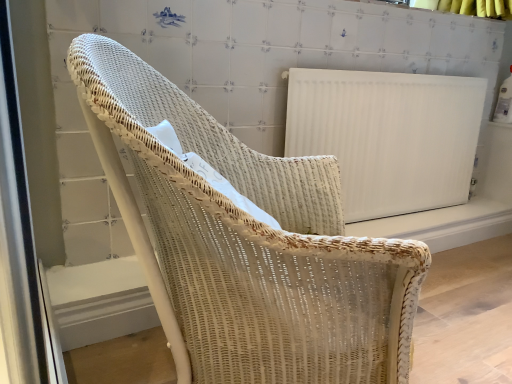
Question: Is the surface of white wicker chair at center in direct contact with white ribbed radiator at upper right?

Choices:
 (A) no
 (B) yes

Answer: (A)

Question: Is white wicker chair at center further to camera compared to white ribbed radiator at upper right?

Choices:
 (A) yes
 (B) no

Answer: (B)

Question: Can you confirm if white wicker chair at center is taller than white ribbed radiator at upper right?

Choices:
 (A) yes
 (B) no

Answer: (A)

Question: Considering the relative sizes of white wicker chair at center and white ribbed radiator at upper right in the image provided, is white wicker chair at center bigger than white ribbed radiator at upper right?

Choices:
 (A) no
 (B) yes

Answer: (B)

Question: Can you confirm if white wicker chair at center is shorter than white ribbed radiator at upper right?

Choices:
 (A) no
 (B) yes

Answer: (A)

Question: Is white wicker chair at center thinner than white ribbed radiator at upper right?

Choices:
 (A) yes
 (B) no

Answer: (B)

Question: Is white ribbed radiator at upper right to the left of white wicker chair at center from the viewer's perspective?

Choices:
 (A) no
 (B) yes

Answer: (A)

Question: Is white ribbed radiator at upper right placed right next to white wicker chair at center?

Choices:
 (A) yes
 (B) no

Answer: (B)

Question: From the image's perspective, is white ribbed radiator at upper right beneath white wicker chair at center?

Choices:
 (A) no
 (B) yes

Answer: (A)

Question: Is the depth of white ribbed radiator at upper right greater than that of white wicker chair at center?

Choices:
 (A) no
 (B) yes

Answer: (B)

Question: Does white ribbed radiator at upper right have a lesser width compared to white wicker chair at center?

Choices:
 (A) no
 (B) yes

Answer: (B)

Question: Does white ribbed radiator at upper right have a greater width compared to white wicker chair at center?

Choices:
 (A) yes
 (B) no

Answer: (B)

Question: Based on their sizes in the image, would you say white ribbed radiator at upper right is bigger or smaller than white wicker chair at center?

Choices:
 (A) big
 (B) small

Answer: (B)